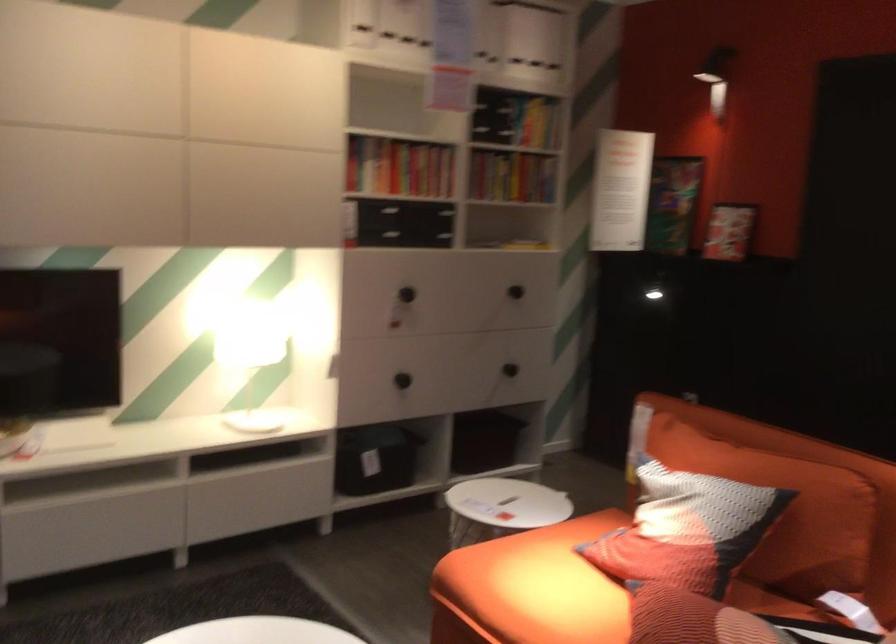
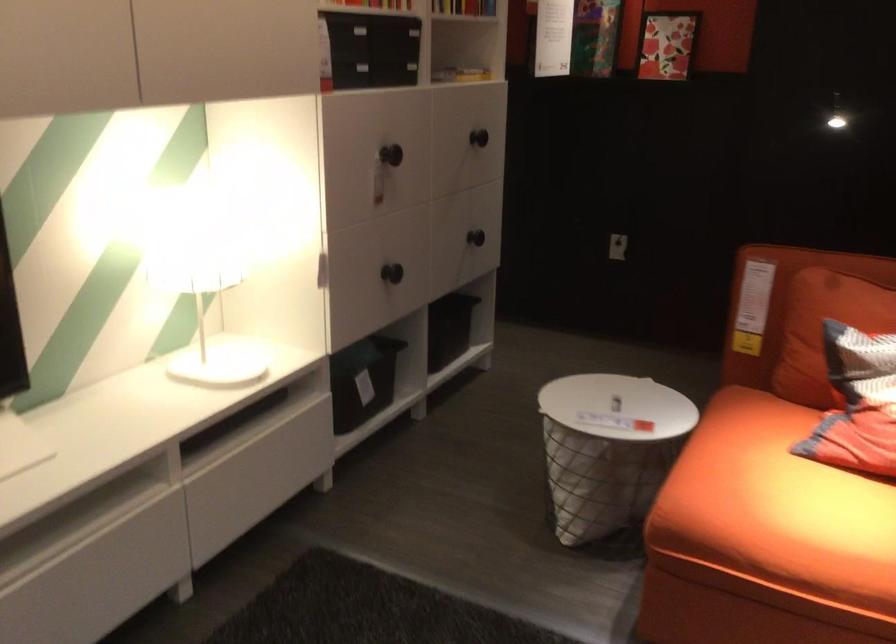
Which direction would the cameraman need to move to produce the second image?

The cameraman walked toward left, forward.